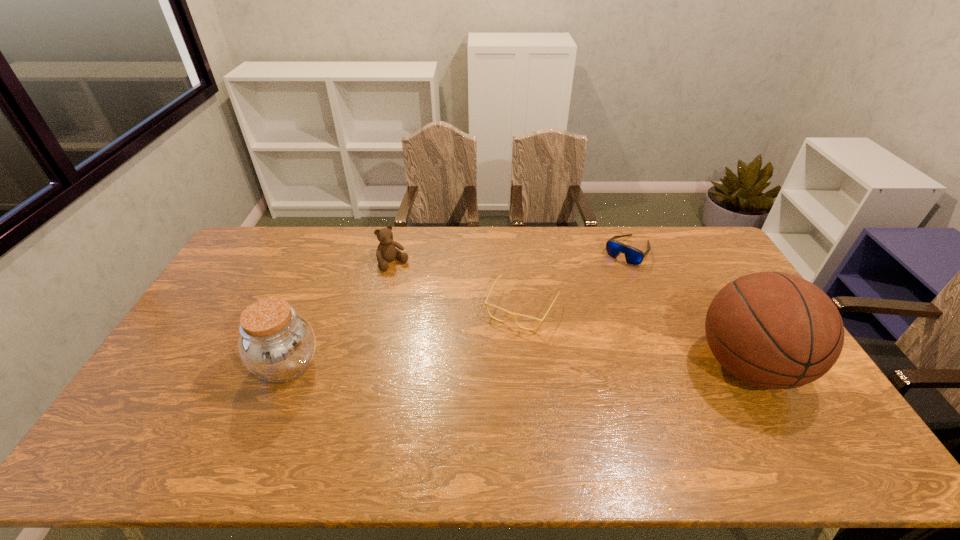
I want to click on free space between the basketball and the jar, so click(x=517, y=365).

Where is `blank region between the spectacles and the second tallest object`? blank region between the spectacles and the second tallest object is located at coordinates (404, 336).

I want to click on vacant area that lies between the third shortest object and the fourth shortest object, so click(x=340, y=314).

Image resolution: width=960 pixels, height=540 pixels. Find the location of `unoccupied position between the fourth tallest object and the third tallest object`. unoccupied position between the fourth tallest object and the third tallest object is located at coordinates (511, 256).

Where is `free space that is in between the basketball and the sunglasses`? The image size is (960, 540). free space that is in between the basketball and the sunglasses is located at coordinates (688, 308).

Locate an element on the screen. free spot between the teddy bear and the jar is located at coordinates tap(340, 314).

Image resolution: width=960 pixels, height=540 pixels. What are the coordinates of `empty space between the jar and the basketball` in the screenshot? It's located at (517, 365).

Where is `vacant space that is in between the basketball and the second shortest object`? This screenshot has height=540, width=960. vacant space that is in between the basketball and the second shortest object is located at coordinates (688, 308).

Point out which object is positioned as the nearest to the fourth object from right to left. Please provide its 2D coordinates. Your answer should be formatted as a tuple, i.e. [(x, y)], where the tuple contains the x and y coordinates of a point satisfying the conditions above.

[(509, 313)]

The image size is (960, 540). I want to click on the closest object to the leftmost object, so click(386, 251).